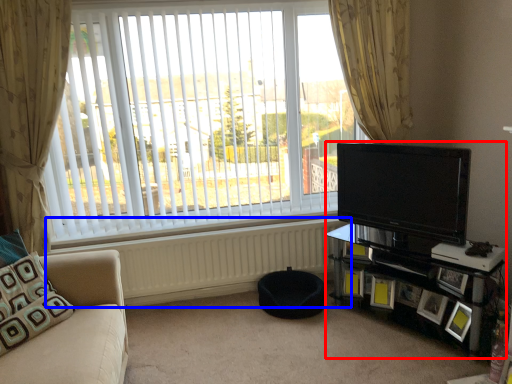
Question: Among these objects, which one is farthest to the camera, entertainment center (highlighted by a red box) or radiator (highlighted by a blue box)?

Choices:
 (A) entertainment center
 (B) radiator

Answer: (B)